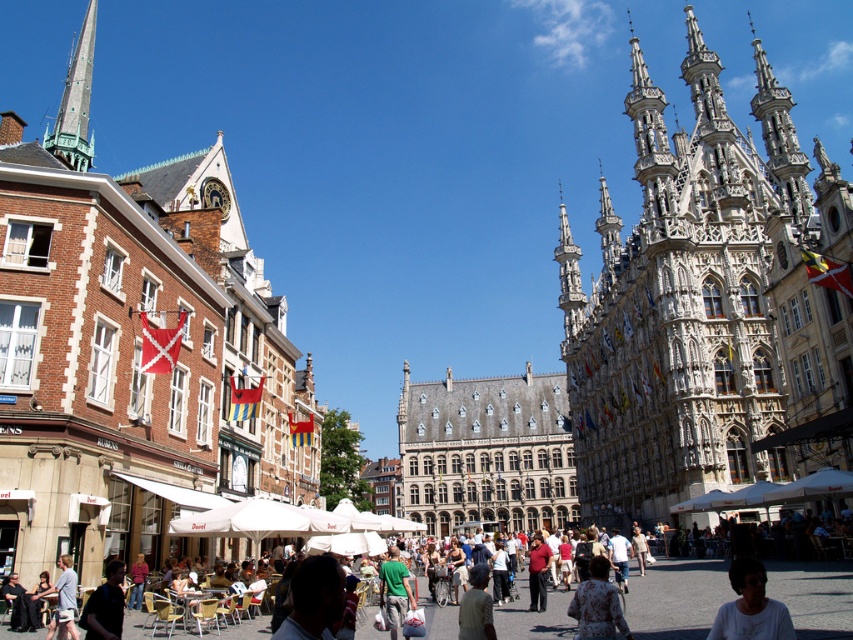
Question: Is shiny green spire at upper left bigger than green matte shirt at center?

Choices:
 (A) no
 (B) yes

Answer: (B)

Question: Which of these objects is positioned closest to the floral-patterned blouse at center?

Choices:
 (A) white stone tower at upper right
 (B) shiny green spire at upper left
 (C) light brown leather jacket at center

Answer: (C)

Question: Can you confirm if light brown leather jacket at center is thinner than white matte shirt at lower right?

Choices:
 (A) no
 (B) yes

Answer: (A)

Question: Among these points, which one is farthest from the camera?

Choices:
 (A) (637, 598)
 (B) (583, 611)
 (C) (756, 609)
 (D) (593, 483)

Answer: (D)

Question: Which of the following is the closest to the observer?

Choices:
 (A) (769, 616)
 (B) (596, 625)
 (C) (405, 580)

Answer: (A)

Question: Is white stone tower at upper right positioned behind green matte shirt at center?

Choices:
 (A) no
 (B) yes

Answer: (B)